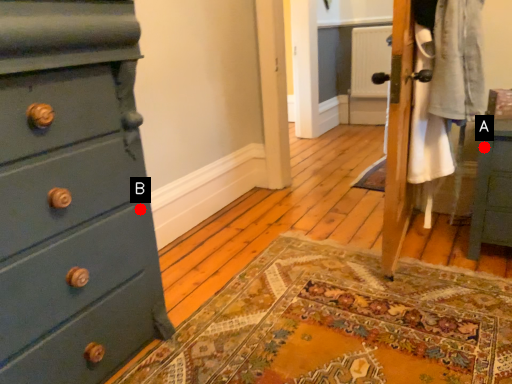
Question: Two points are circled on the image, labeled by A and B beside each circle. Which point is closer to the camera?

Choices:
 (A) A is closer
 (B) B is closer

Answer: (B)